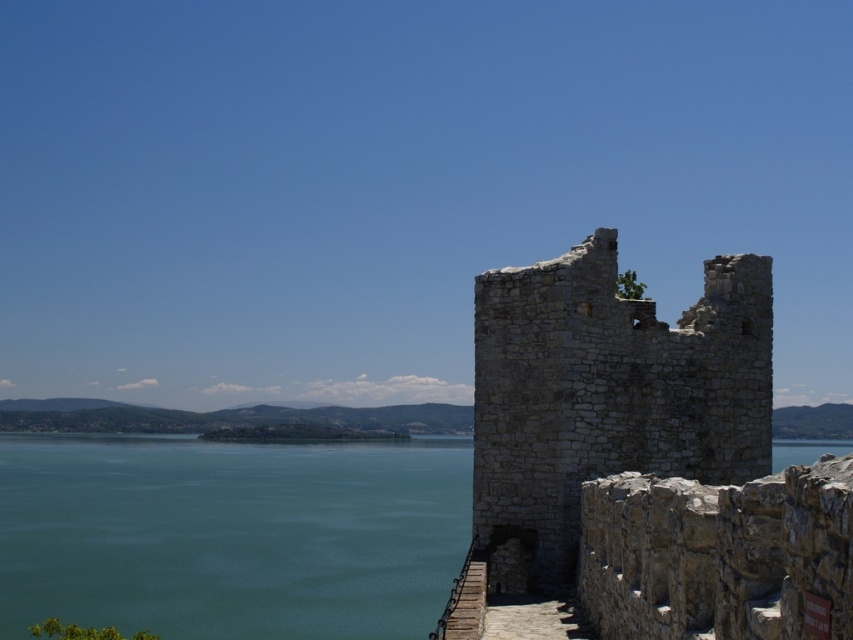
Who is more forward, (125, 628) or (549, 259)?

Result: Point (549, 259) is more forward.

Who is more distant from viewer, (149, 552) or (509, 477)?

Positioned behind is point (149, 552).

The image size is (853, 640). In order to click on green water at lower left in this screenshot , I will do `click(230, 536)`.

Locate an element on the screen. green water at lower left is located at coordinates (230, 536).